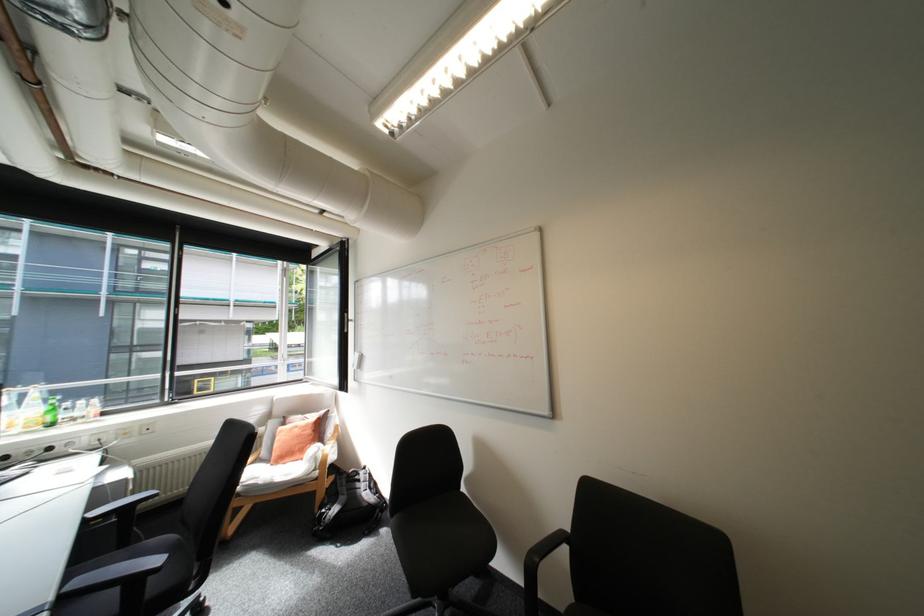
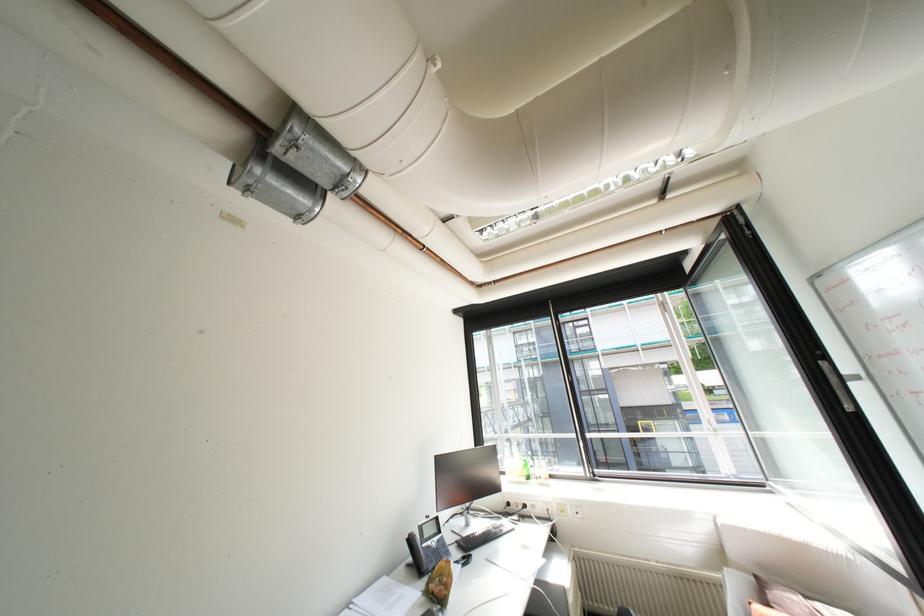
Based on the continuous images, in which direction is the camera rotating?

The camera's rotation is toward left-up.